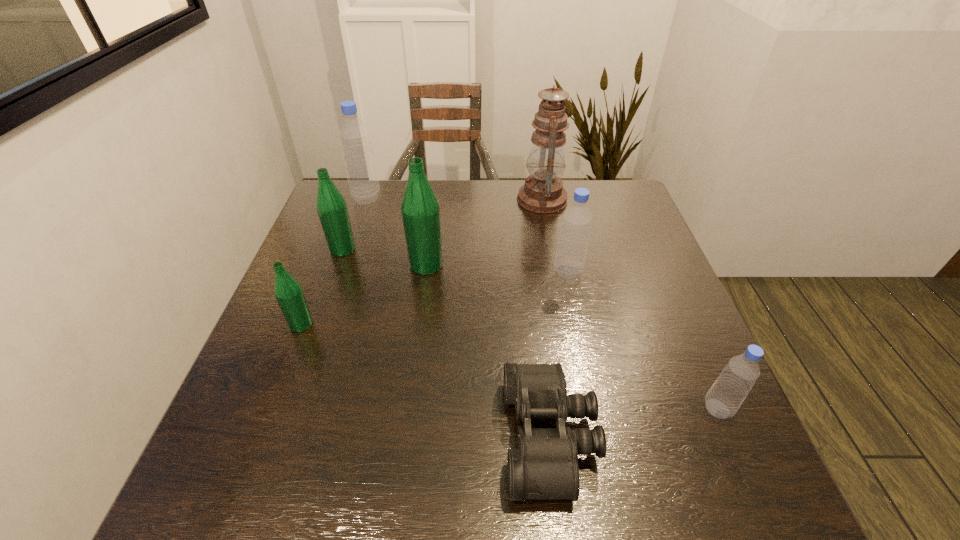
Find the location of `the rightmost bottle`. the rightmost bottle is located at coordinates (724, 398).

Where is `the nearest bottle`? This screenshot has height=540, width=960. the nearest bottle is located at coordinates (724, 398).

The height and width of the screenshot is (540, 960). Identify the location of binoculars. (545, 466).

The height and width of the screenshot is (540, 960). I want to click on the shortest object, so click(545, 466).

Where is `vacant point located on the left of the oil lamp`? The width and height of the screenshot is (960, 540). vacant point located on the left of the oil lamp is located at coordinates (466, 199).

Identify the location of vacant space located on the right of the biggest blue bottle. The image size is (960, 540). (454, 198).

Locate an element on the screen. The image size is (960, 540). free space located on the front of the fourth bottle from left to right is located at coordinates (414, 361).

What are the coordinates of `free space located 0.050m on the left of the fifth bottle from left to right` in the screenshot? It's located at (534, 272).

Identify the location of vacant region located on the right of the second biggest green bottle. The image size is (960, 540). (378, 249).

Where is `vacant space situated on the back of the nearest green bottle`? vacant space situated on the back of the nearest green bottle is located at coordinates (328, 254).